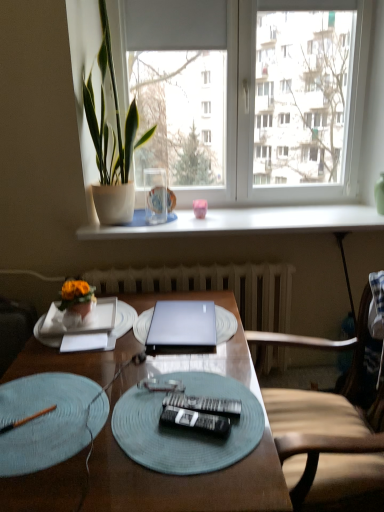
Identify the location of vacant area that lies between black plastic remote control at center, the 1th remote control when ordered from front to back, and orange wood pen at lower left. (99, 426).